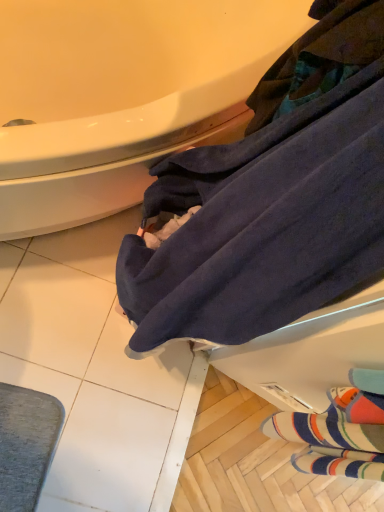
Question: From the image's perspective, is dark blue towel at lower right on top of white glossy bathtub at upper left?

Choices:
 (A) no
 (B) yes

Answer: (A)

Question: Considering the relative sizes of dark blue towel at lower right and white glossy bathtub at upper left in the image provided, is dark blue towel at lower right smaller than white glossy bathtub at upper left?

Choices:
 (A) yes
 (B) no

Answer: (A)

Question: Considering the relative sizes of dark blue towel at lower right and white glossy bathtub at upper left in the image provided, is dark blue towel at lower right thinner than white glossy bathtub at upper left?

Choices:
 (A) yes
 (B) no

Answer: (A)

Question: Does dark blue towel at lower right turn towards white glossy bathtub at upper left?

Choices:
 (A) no
 (B) yes

Answer: (A)

Question: Can you confirm if dark blue towel at lower right is bigger than white glossy bathtub at upper left?

Choices:
 (A) yes
 (B) no

Answer: (B)

Question: Does point (327, 187) appear closer or farther from the camera than point (34, 166)?

Choices:
 (A) closer
 (B) farther

Answer: (A)

Question: Based on their positions, is dark blue towel at lower right located to the left or right of white glossy bathtub at upper left?

Choices:
 (A) right
 (B) left

Answer: (A)

Question: Relative to white glossy bathtub at upper left, is dark blue towel at lower right in front or behind?

Choices:
 (A) behind
 (B) front

Answer: (B)

Question: Is dark blue towel at lower right wider or thinner than white glossy bathtub at upper left?

Choices:
 (A) thin
 (B) wide

Answer: (A)

Question: Looking at their shapes, would you say white glossy bathtub at upper left is wider or thinner than striped wool socks at lower right?

Choices:
 (A) thin
 (B) wide

Answer: (B)

Question: Is white glossy bathtub at upper left bigger or smaller than striped wool socks at lower right?

Choices:
 (A) big
 (B) small

Answer: (A)

Question: From the image's perspective, relative to striped wool socks at lower right, is white glossy bathtub at upper left above or below?

Choices:
 (A) below
 (B) above

Answer: (B)

Question: From a real-world perspective, relative to striped wool socks at lower right, is white glossy bathtub at upper left vertically above or below?

Choices:
 (A) below
 (B) above

Answer: (A)

Question: From the image's perspective, is striped wool socks at lower right above or below dark blue towel at lower right?

Choices:
 (A) below
 (B) above

Answer: (A)

Question: Looking at their shapes, would you say striped wool socks at lower right is wider or thinner than dark blue towel at lower right?

Choices:
 (A) wide
 (B) thin

Answer: (B)